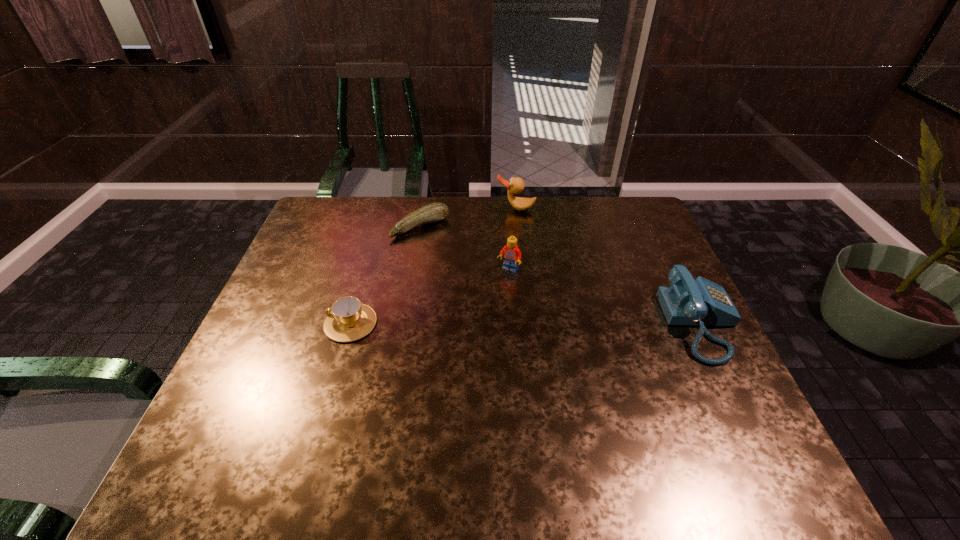
Locate an element on the screen. The height and width of the screenshot is (540, 960). vacant space that satisfies the following two spatial constraints: 1. on the back side of the zucchini; 2. on the right side of the duck is located at coordinates (423, 209).